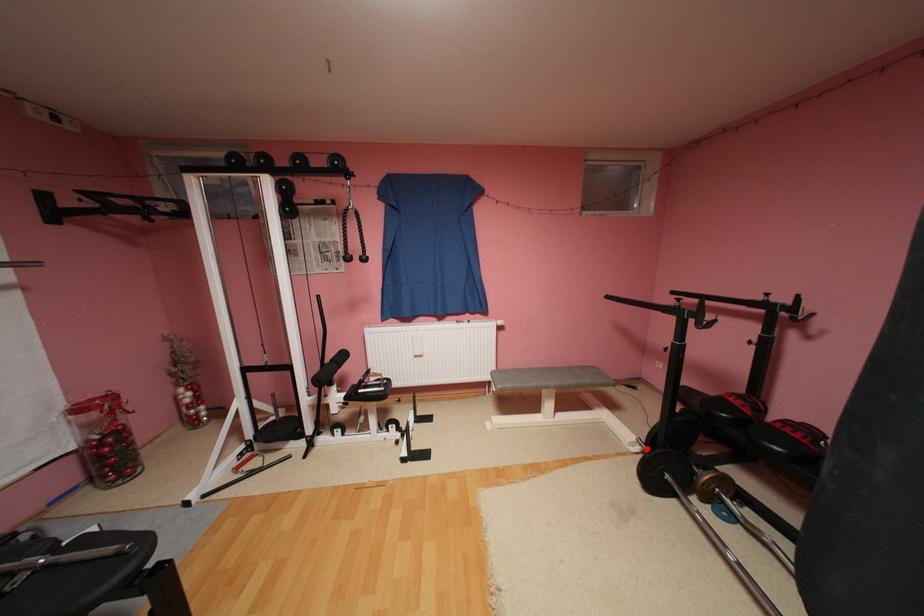
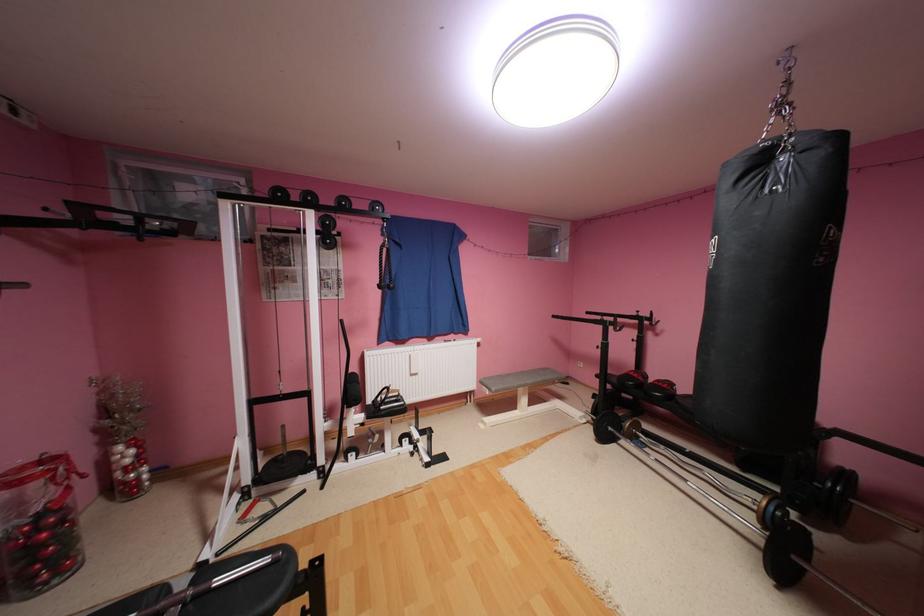
Find the pixel in the second image that matches the highlighted location in the first image.

(593, 419)